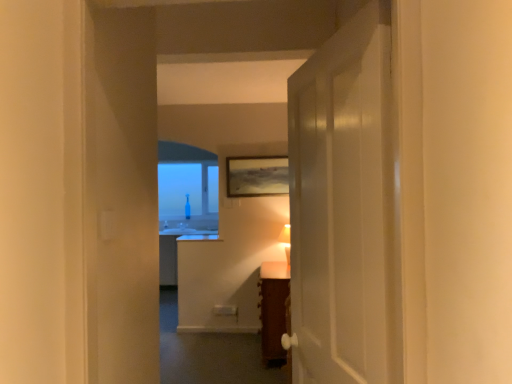
Question: Is wooden cabinet at center far from transparent glass bottle at center?

Choices:
 (A) no
 (B) yes

Answer: (B)

Question: Is wooden cabinet at center positioned beyond the bounds of transparent glass bottle at center?

Choices:
 (A) no
 (B) yes

Answer: (B)

Question: Can you confirm if wooden cabinet at center is bigger than transparent glass bottle at center?

Choices:
 (A) yes
 (B) no

Answer: (B)

Question: Does wooden cabinet at center lie behind transparent glass bottle at center?

Choices:
 (A) yes
 (B) no

Answer: (B)

Question: Is wooden cabinet at center to the left of transparent glass bottle at center from the viewer's perspective?

Choices:
 (A) yes
 (B) no

Answer: (B)

Question: Is transparent glass bottle at center surrounded by wooden cabinet at center?

Choices:
 (A) yes
 (B) no

Answer: (B)

Question: Is white glossy door at center aimed at wooden cabinet at center?

Choices:
 (A) no
 (B) yes

Answer: (A)

Question: Is wooden cabinet at center completely or partially inside white glossy door at center?

Choices:
 (A) no
 (B) yes

Answer: (A)

Question: From the image's perspective, is white glossy door at center on top of wooden cabinet at center?

Choices:
 (A) yes
 (B) no

Answer: (A)

Question: Does white glossy door at center have a smaller size compared to wooden cabinet at center?

Choices:
 (A) yes
 (B) no

Answer: (A)

Question: Is white glossy door at center touching wooden cabinet at center?

Choices:
 (A) no
 (B) yes

Answer: (A)

Question: Can you confirm if white glossy door at center is positioned to the left of wooden cabinet at center?

Choices:
 (A) no
 (B) yes

Answer: (A)

Question: Is white glossy door at center at the left side of wooden textured picture frame at center?

Choices:
 (A) no
 (B) yes

Answer: (A)